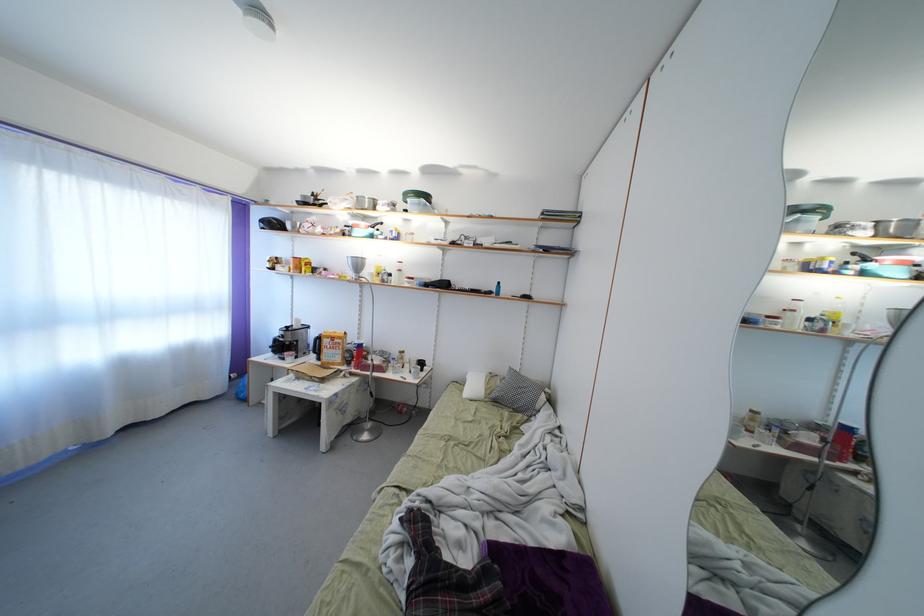
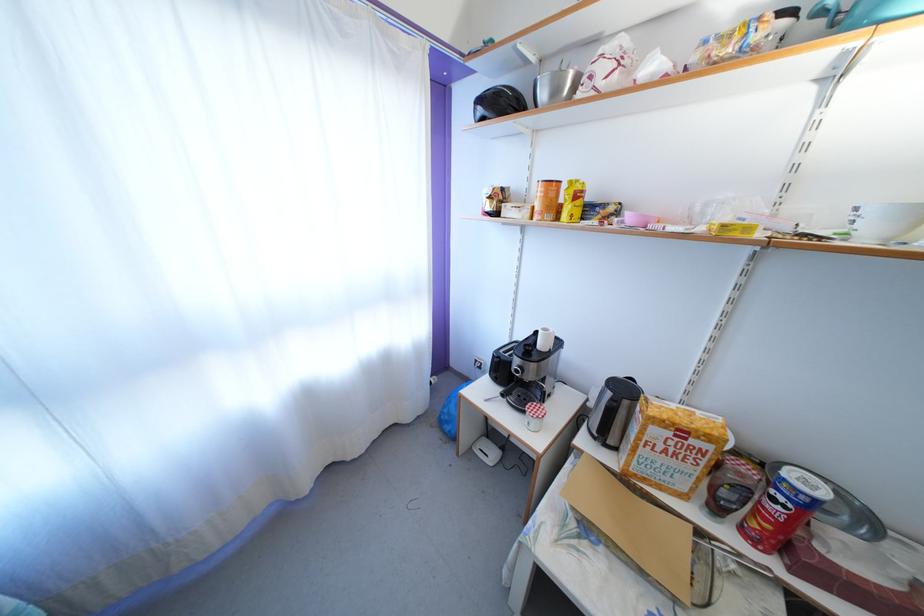
In the second image, find the point that corresponds to point (268, 227) in the first image.

(484, 107)